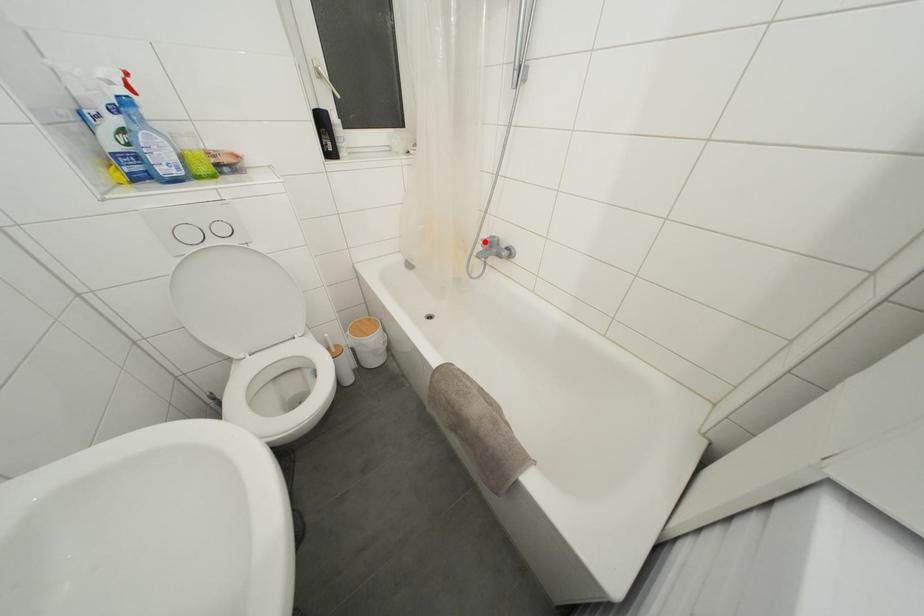
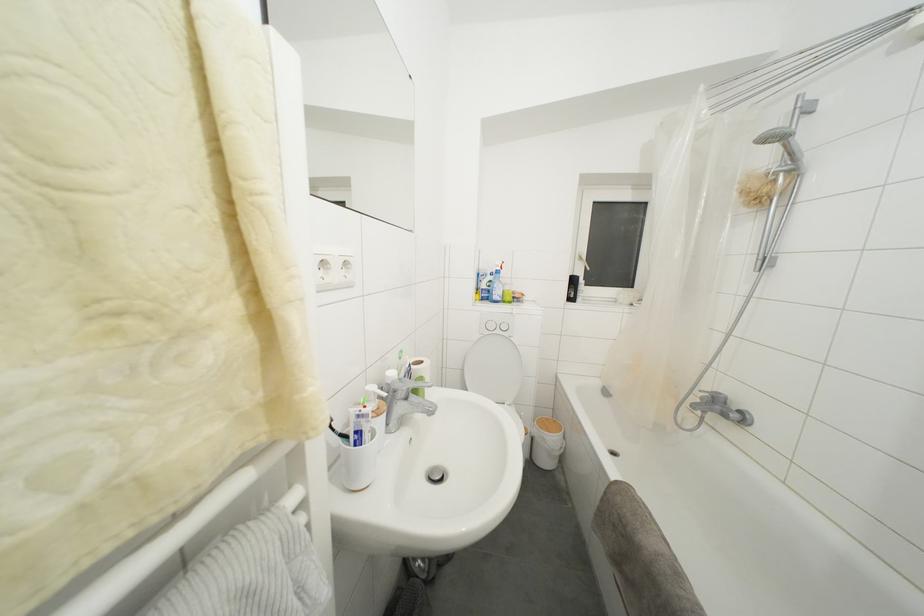
In the second image, find the point that corresponds to the highlighted location in the first image.

(703, 392)